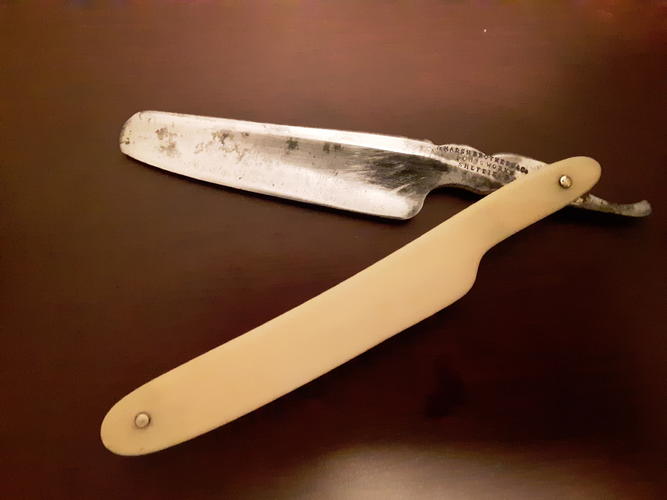
Locate an element on the screen. This screenshot has height=500, width=667. white spot on table is located at coordinates (486, 29).